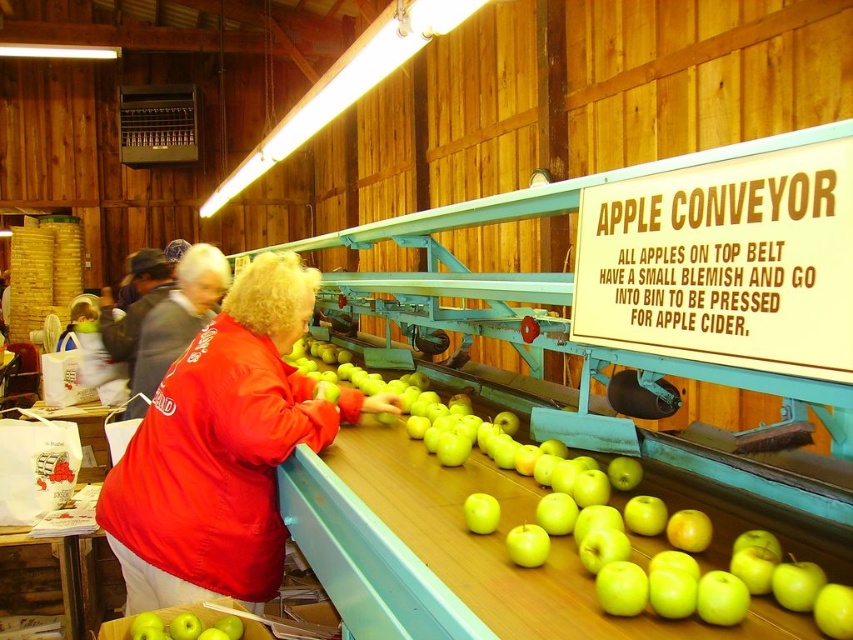
Question: Which object is closer to the camera taking this photo?

Choices:
 (A) green matte apple at lower left
 (B) green shiny apple at center
 (C) red fabric jacket at center

Answer: (B)

Question: Which of these objects is positioned closest to the red fabric jacket at center?

Choices:
 (A) green matte apple at lower left
 (B) green shiny apple at center

Answer: (A)

Question: Can you confirm if red fabric jacket at center is positioned above green matte apple at lower left?

Choices:
 (A) yes
 (B) no

Answer: (A)

Question: In this image, where is green shiny apple at center located relative to green matte apple at lower left?

Choices:
 (A) left
 (B) right

Answer: (B)

Question: Which point is farther to the camera?

Choices:
 (A) green matte apple at lower left
 (B) green shiny apple at center

Answer: (A)

Question: From the image, what is the correct spatial relationship of red fabric jacket at center in relation to green matte apple at lower left?

Choices:
 (A) above
 (B) below

Answer: (A)